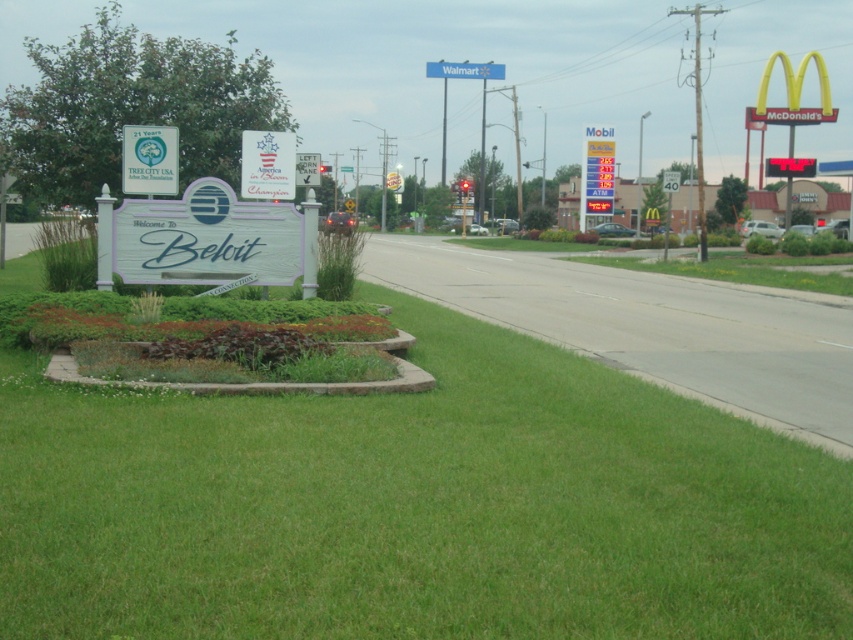
You are a delivery driver who needs to park your truck between the green grass at lower center and the green matte sign at upper left. The truck is 20 feet long. Can you park it there without overlapping either object?

A: The distance between the green grass at lower center and the green matte sign at upper left is 22.31 feet. Since the truck is 20 feet long, there is enough space to park it between them without overlapping either object.

You are standing at the Walmart sign mounted on a tall pole in the background. Looking towards the foreground, can you see the green grass at lower center?

Yes, the green grass at lower center is located at point (415, 506), which is in the lower center of the image, so you can see it from the Walmart sign in the background.

Based on the photo, you are a pedestrian standing at the edge of the grassy area. You see the green grass at lower center and the metallic silver speed limit sign at right. Which object is closer to you?

The green grass at lower center is closer to you because it is positioned under the metallic silver speed limit sign at right, meaning the sign is further away.